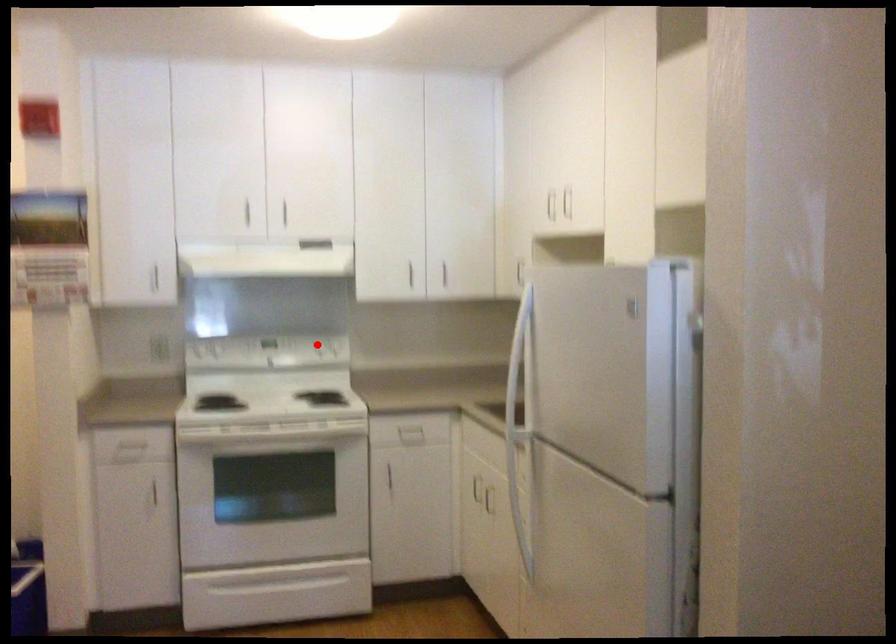
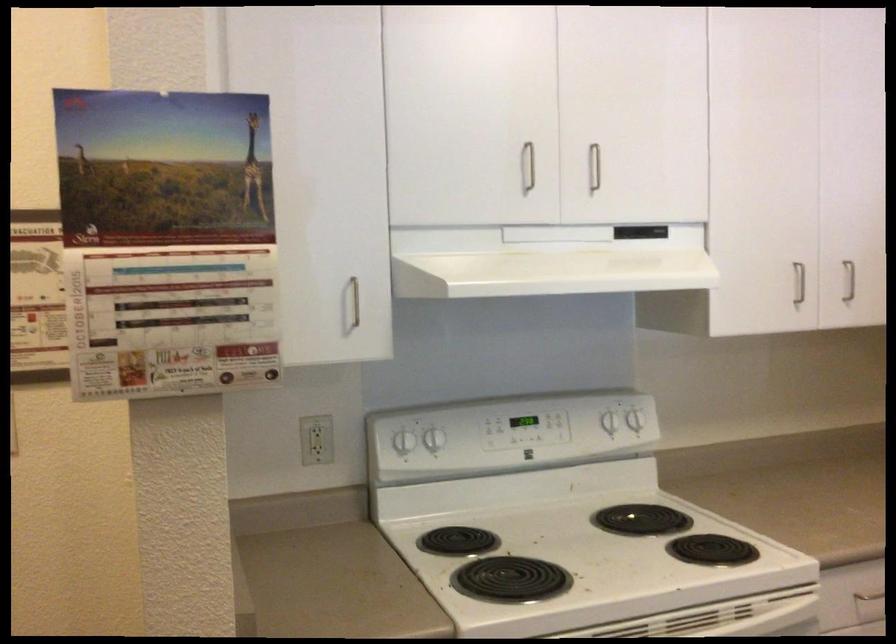
Question: I am providing you with two images of the same scene from different viewpoints. In image1, a red point is highlighted. Considering the same 3D point in image2, which of the following is correct?

Choices:
 (A) It is closer
 (B) It is farther

Answer: (A)